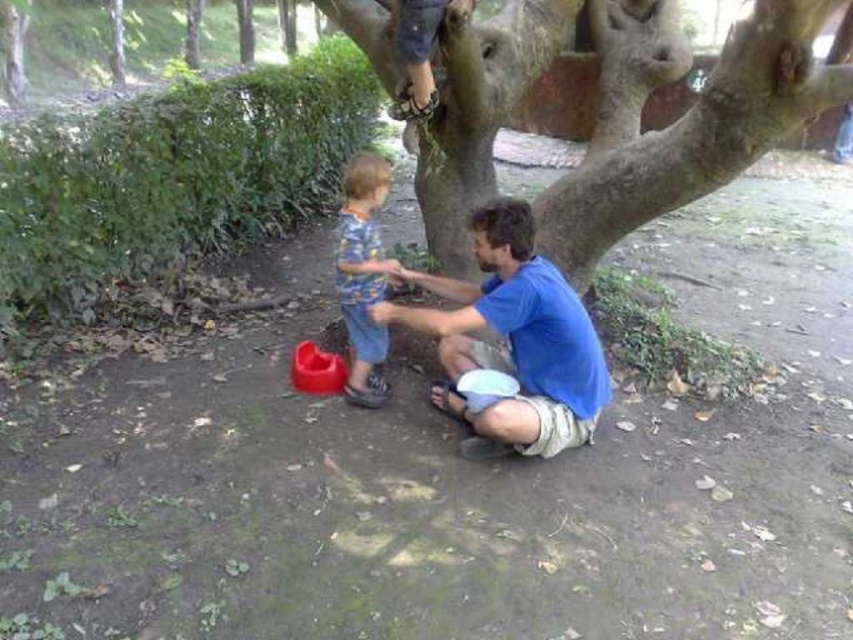
Question: Which object appears closest to the camera in this image?

Choices:
 (A) matte blue shirt at center
 (B) blue cotton shirt at center

Answer: (B)

Question: Estimate the real-world distances between objects in this image. Which object is farther from the rough bark tree at center?

Choices:
 (A) matte blue shirt at center
 (B) blue cotton shirt at center

Answer: (A)

Question: From the image, what is the correct spatial relationship of rough bark tree at center in relation to matte blue shirt at center?

Choices:
 (A) below
 (B) above

Answer: (B)

Question: Which object is the farthest from the rough bark tree at center?

Choices:
 (A) matte blue shirt at center
 (B) blue cotton shirt at center

Answer: (A)

Question: Does rough bark tree at center have a smaller size compared to blue cotton shirt at center?

Choices:
 (A) no
 (B) yes

Answer: (A)

Question: Can you confirm if rough bark tree at center is smaller than blue cotton shirt at center?

Choices:
 (A) yes
 (B) no

Answer: (B)